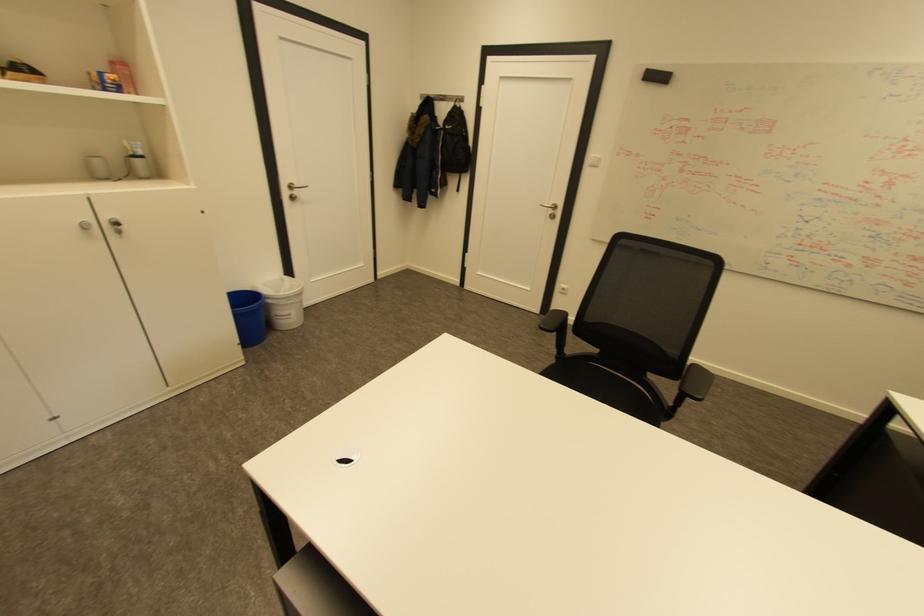
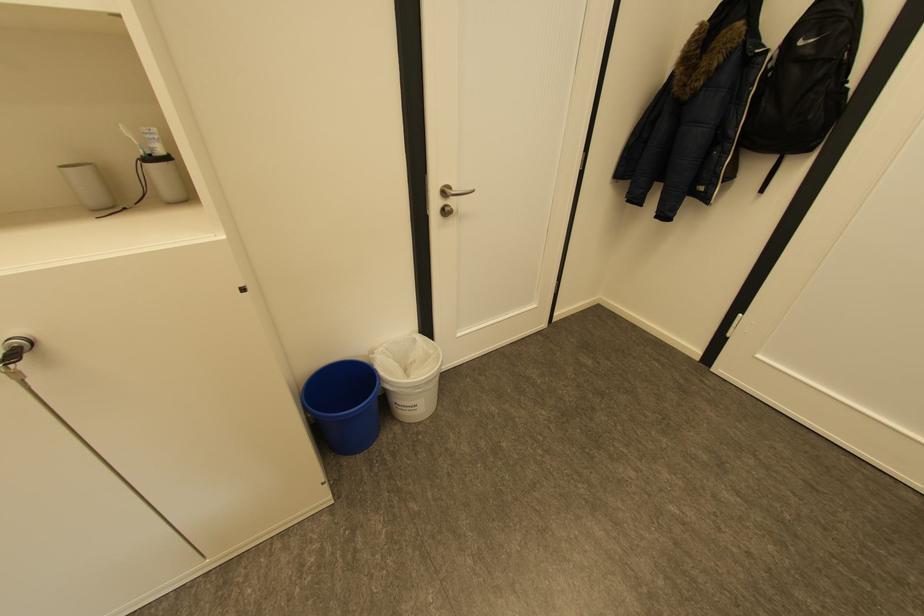
The point at (x=143, y=156) is marked in the first image. Where is the corresponding point in the second image?

(157, 159)